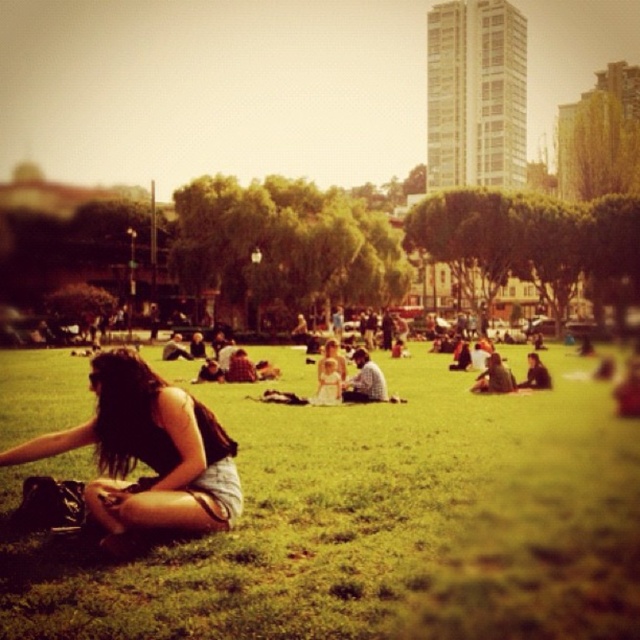
You are standing in the park and want to reach both the point at coordinates point (3, 611) and point (176, 508). Which point should you go to first if you want to minimize the distance walked?

You should go to point (3, 611) first because it is closer to you than point (176, 508), so you can reach it with less walking distance.

You are a photographer trying to capture a candid shot of the person wearing the matte black tank top at lower left and light blue denim jeans at center. Since you want to focus on their interaction, which clothing item should you position closer to the camera to ensure both are in frame?

The matte black tank top at lower left is located below the light blue denim jeans at center. To ensure both are in frame, position the camera closer to the light blue denim jeans at center so that the lower positioned matte black tank top at lower left remains within the shot.